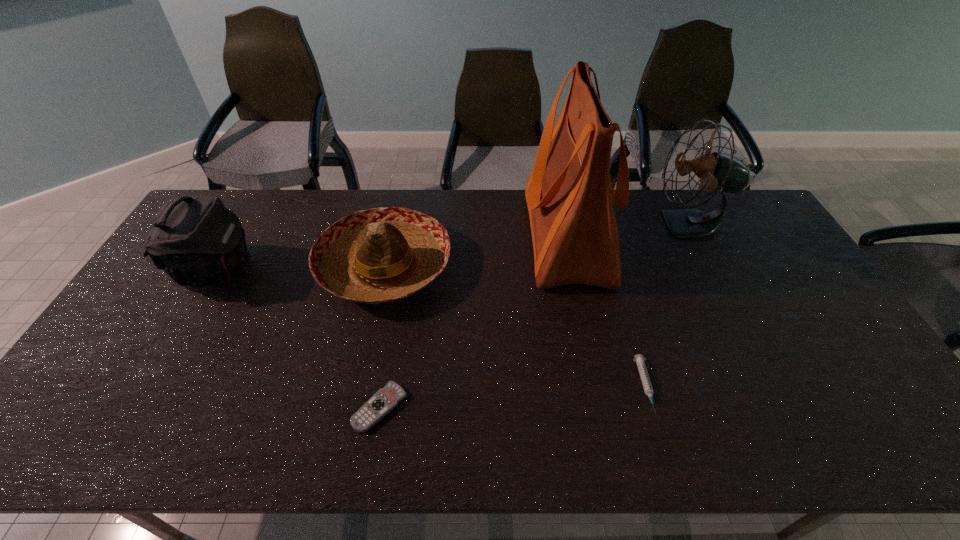
Where is `vacant space situated on the front pocket of the tallest object`? The width and height of the screenshot is (960, 540). vacant space situated on the front pocket of the tallest object is located at coordinates (499, 236).

Identify the location of vacant area located on the front-facing side of the second tallest object for air flow. (619, 224).

The width and height of the screenshot is (960, 540). Find the location of `vacant point located on the front-facing side of the second tallest object for air flow`. vacant point located on the front-facing side of the second tallest object for air flow is located at coordinates point(550,224).

You are a GUI agent. You are given a task and a screenshot of the screen. Output one action in this format:
    pyautogui.click(x=<x>, y=<y>)
    Task: Click on the free space located 0.180m on the front-facing side of the second tallest object for air flow
    
    Given the screenshot: What is the action you would take?
    pyautogui.click(x=599, y=224)

You are a GUI agent. You are given a task and a screenshot of the screen. Output one action in this format:
    pyautogui.click(x=<x>, y=<y>)
    Task: Click on the free space located on the open flap of the shoulder bag
    The height and width of the screenshot is (540, 960).
    Given the screenshot: What is the action you would take?
    pyautogui.click(x=334, y=271)

Locate an element on the screen. The height and width of the screenshot is (540, 960). vacant space situated on the left of the third shortest object is located at coordinates (231, 266).

The height and width of the screenshot is (540, 960). I want to click on vacant region located 0.210m on the left of the shortest object, so click(x=266, y=407).

This screenshot has height=540, width=960. In order to click on shopping bag that is positioned at the far edge in this screenshot , I will do `click(569, 194)`.

Where is `fan that is at the far edge`? The image size is (960, 540). fan that is at the far edge is located at coordinates point(717,171).

Find the location of a particular element. Image resolution: width=960 pixels, height=540 pixels. sombrero present at the far edge is located at coordinates (379, 255).